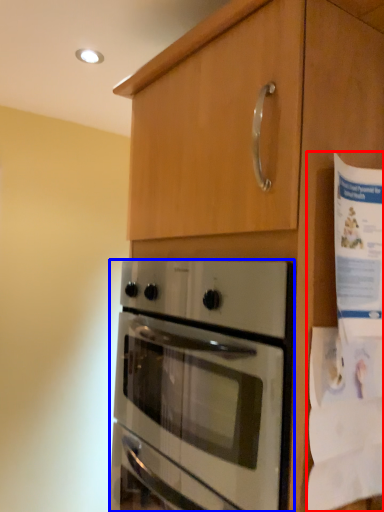
Question: Which point is closer to the camera, paper (highlighted by a red box) or oven (highlighted by a blue box)?

Choices:
 (A) paper
 (B) oven

Answer: (B)